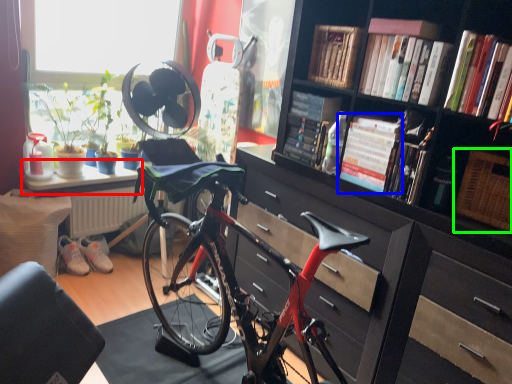
Question: Which object is the closest to the table (highlighted by a red box)? Choose among these: book (highlighted by a blue box) or picnic basket (highlighted by a green box).

Choices:
 (A) book
 (B) picnic basket

Answer: (A)